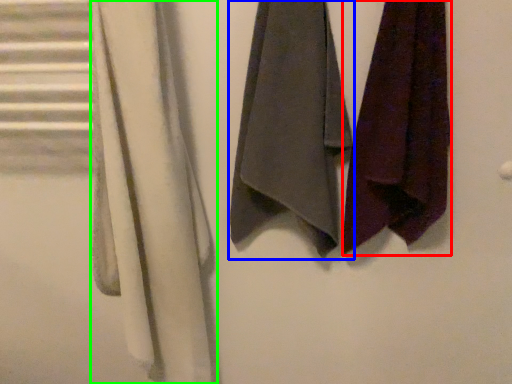
Question: Based on their relative distances, which object is farther from towel (highlighted by a red box)? Choose from towel (highlighted by a blue box) and cloth (highlighted by a green box).

Choices:
 (A) towel
 (B) cloth

Answer: (B)